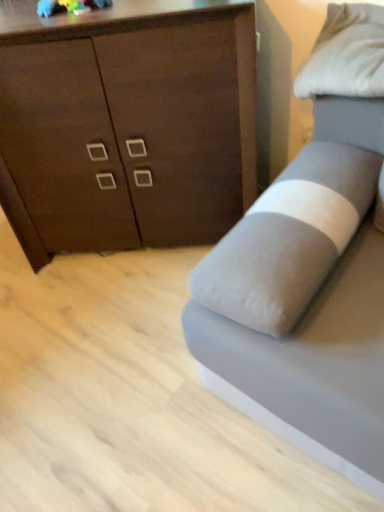
Question: Is the depth of white soft pillow at upper right greater than that of gray fabric studio couch at right?

Choices:
 (A) yes
 (B) no

Answer: (A)

Question: Can you confirm if white soft pillow at upper right is positioned to the right of gray fabric studio couch at right?

Choices:
 (A) yes
 (B) no

Answer: (A)

Question: From a real-world perspective, does white soft pillow at upper right stand above gray fabric studio couch at right?

Choices:
 (A) yes
 (B) no

Answer: (A)

Question: From the image's perspective, is white soft pillow at upper right on gray fabric studio couch at right?

Choices:
 (A) yes
 (B) no

Answer: (A)

Question: Is white soft pillow at upper right thinner than gray fabric studio couch at right?

Choices:
 (A) no
 (B) yes

Answer: (B)

Question: Can we say white soft pillow at upper right lies outside gray fabric studio couch at right?

Choices:
 (A) no
 (B) yes

Answer: (A)

Question: From the image's perspective, would you say gray fabric studio couch at right is shown under dark wood cabinet at upper left?

Choices:
 (A) no
 (B) yes

Answer: (B)

Question: Is gray fabric studio couch at right positioned in front of dark wood cabinet at upper left?

Choices:
 (A) no
 (B) yes

Answer: (B)

Question: Considering the relative sizes of gray fabric studio couch at right and dark wood cabinet at upper left in the image provided, is gray fabric studio couch at right taller than dark wood cabinet at upper left?

Choices:
 (A) no
 (B) yes

Answer: (A)

Question: Is gray fabric studio couch at right next to dark wood cabinet at upper left?

Choices:
 (A) yes
 (B) no

Answer: (B)

Question: From a real-world perspective, is gray fabric studio couch at right positioned over dark wood cabinet at upper left based on gravity?

Choices:
 (A) no
 (B) yes

Answer: (A)

Question: Could you tell me if gray fabric studio couch at right is facing dark wood cabinet at upper left?

Choices:
 (A) no
 (B) yes

Answer: (A)

Question: From the image's perspective, is dark wood cabinet at upper left over gray fabric studio couch at right?

Choices:
 (A) yes
 (B) no

Answer: (A)